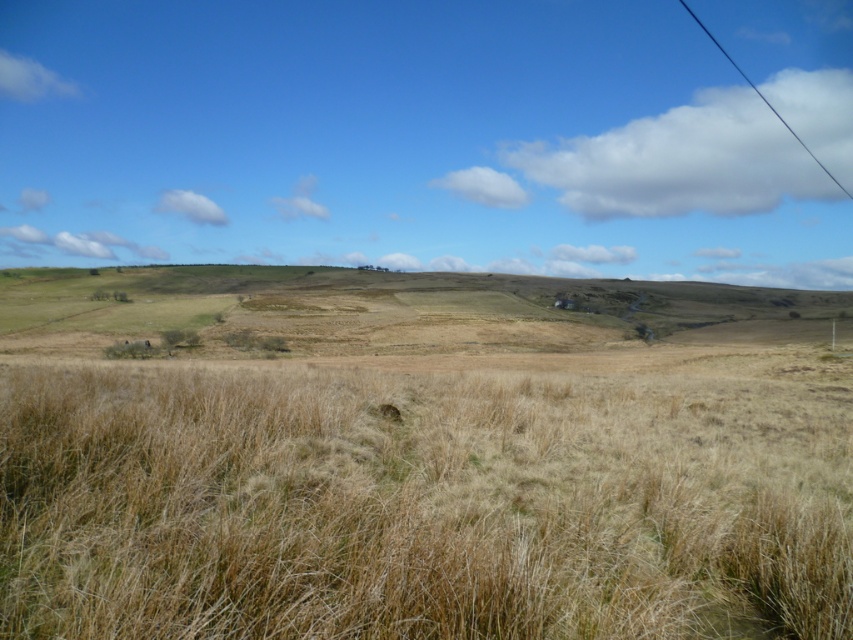
Question: Which point appears farthest from the camera in this image?

Choices:
 (A) (756, 92)
 (B) (723, 445)

Answer: (A)

Question: Among these objects, which one is farthest from the camera?

Choices:
 (A) dry grassland at center
 (B) dry grass at center
 (C) black wire at upper right

Answer: (C)

Question: In this image, where is dry grassland at center located relative to black wire at upper right?

Choices:
 (A) right
 (B) left

Answer: (B)

Question: Is dry grass at center further to camera compared to dry grassland at center?

Choices:
 (A) yes
 (B) no

Answer: (B)

Question: Can you confirm if dry grass at center is bigger than black wire at upper right?

Choices:
 (A) no
 (B) yes

Answer: (A)

Question: Among these points, which one is farthest from the camera?

Choices:
 (A) (426, 296)
 (B) (192, 493)

Answer: (A)